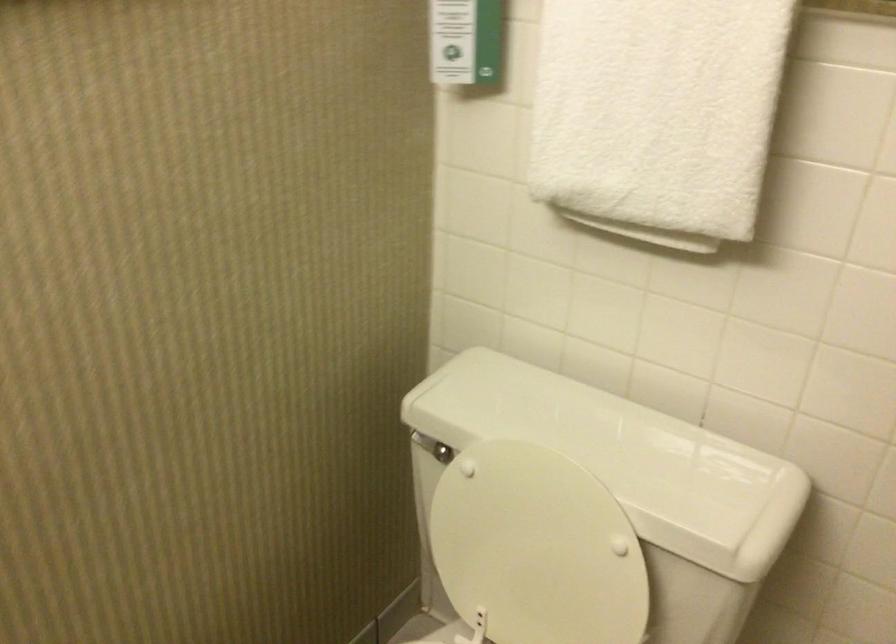
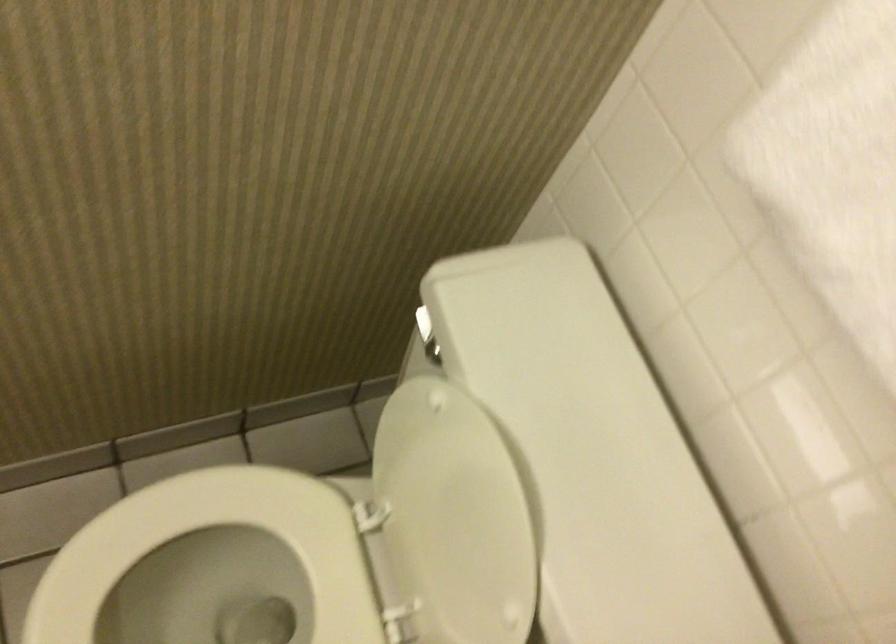
Question: Based on the continuous images, in which direction is the camera rotating? Reply with the corresponding letter.

Choices:
 (A) Left
 (B) Right
 (C) Up
 (D) Down

Answer: (D)